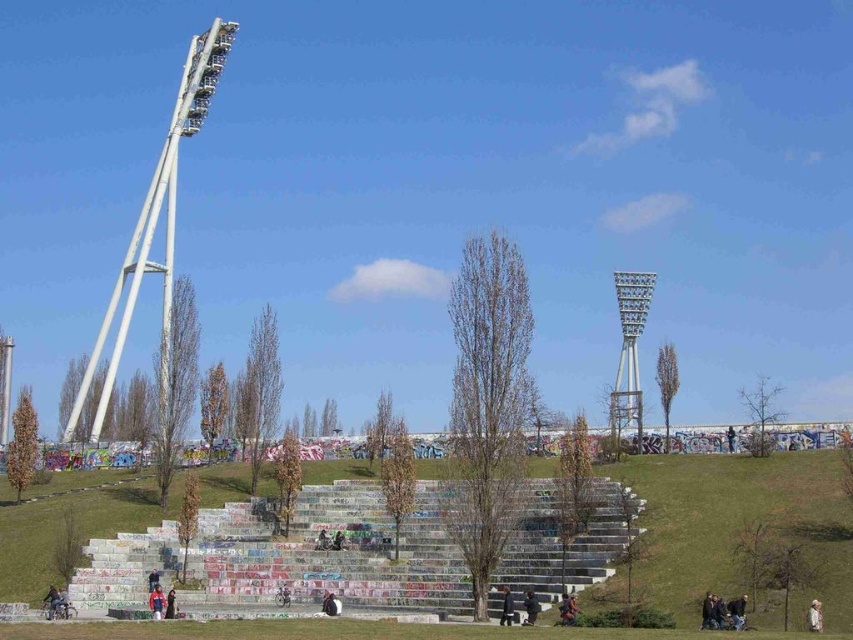
How far apart are concrete steps at center and concrete stairs at center?

The distance of concrete steps at center from concrete stairs at center is 5.95 feet.

Which is in front, point (184, 593) or point (210, 588)?

Point (184, 593) is in front.

Identify the location of concrete steps at center. The height and width of the screenshot is (640, 853). [329, 554].

Does red fabric jacket at lower left have a lesser width compared to white cotton shirt at lower right?

No, red fabric jacket at lower left is not thinner than white cotton shirt at lower right.

Does red fabric jacket at lower left appear under white cotton shirt at lower right?

Yes.

Is point (155, 593) farther from camera compared to point (814, 598)?

Yes, it is behind point (814, 598).

Find the location of a particular element. This screenshot has height=640, width=853. red fabric jacket at lower left is located at coordinates (155, 602).

Is concrete steps at center taller than metallic gray tower at center?

Incorrect, concrete steps at center's height is not larger of metallic gray tower at center's.

Describe the element at coordinates (329, 554) in the screenshot. This screenshot has height=640, width=853. I see `concrete steps at center` at that location.

Locate an element on the screen. concrete steps at center is located at coordinates (329, 554).